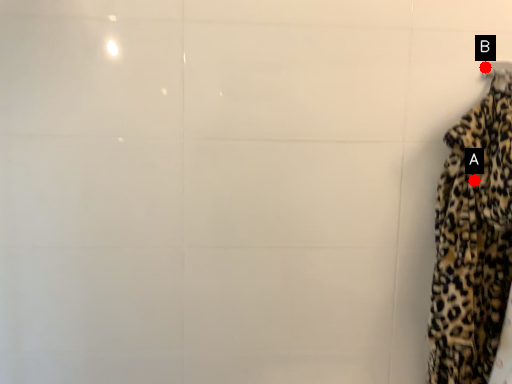
Question: Two points are circled on the image, labeled by A and B beside each circle. Which point is closer to the camera?

Choices:
 (A) A is closer
 (B) B is closer

Answer: (A)